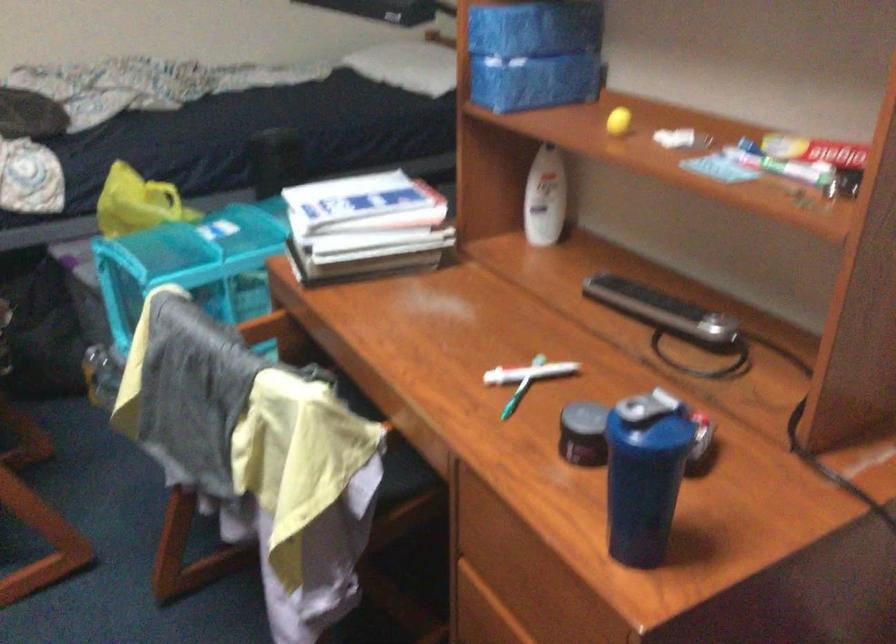
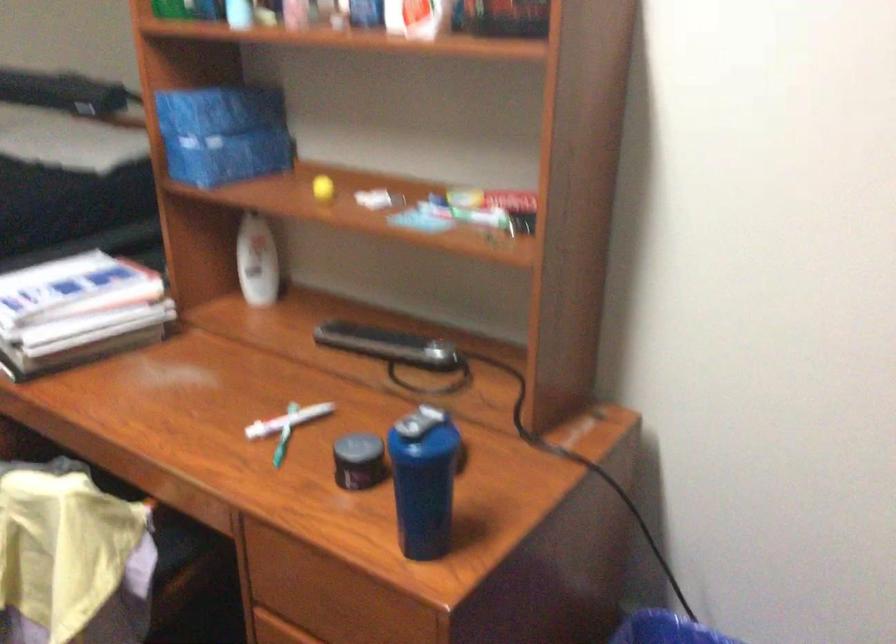
Question: The first image is from the beginning of the video and the second image is from the end. How did the camera likely rotate when shooting the video?

Choices:
 (A) Left
 (B) Right
 (C) Up
 (D) Down

Answer: (B)